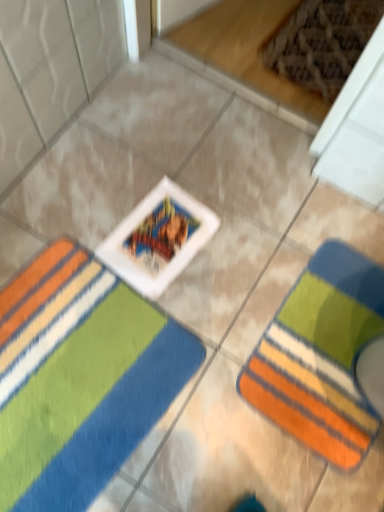
Where is `free space above multicolored plush towel at center, placed as the second towel when sorted from right to left (from a real-world perspective)`? This screenshot has height=512, width=384. free space above multicolored plush towel at center, placed as the second towel when sorted from right to left (from a real-world perspective) is located at coordinates (70, 360).